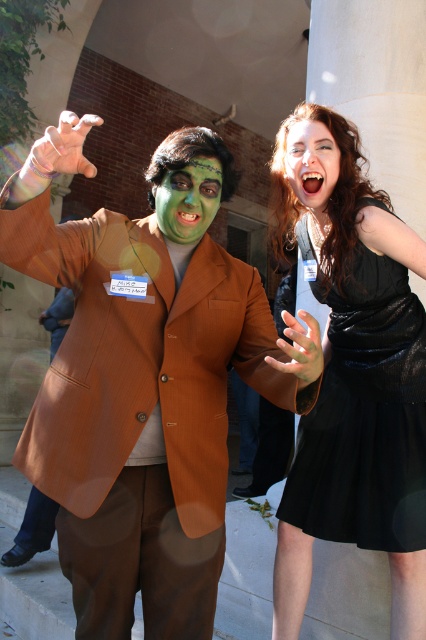
In the scene shown: Does black velvet dress at right have a lesser width compared to green matte face at center?

In fact, black velvet dress at right might be wider than green matte face at center.

Does black velvet dress at right come behind green matte face at center?

Yes, black velvet dress at right is behind green matte face at center.

Consider the image. Who is more forward, (411, 445) or (212, 212)?

Point (212, 212) is in front.

Where is `black velvet dress at right`? Image resolution: width=426 pixels, height=640 pixels. black velvet dress at right is located at coordinates (365, 417).

Does green matte face at center have a lesser height compared to matte black hair at upper right?

Yes.

Can you confirm if green matte face at center is smaller than matte black hair at upper right?

Yes.

Who is more forward, (x=186, y=211) or (x=291, y=140)?

Point (x=186, y=211) is more forward.

You are a GUI agent. You are given a task and a screenshot of the screen. Output one action in this format:
    pyautogui.click(x=<x>, y=<y>)
    Task: Click on the green matte face at center
    The image size is (426, 640).
    Given the screenshot: What is the action you would take?
    pyautogui.click(x=189, y=198)

Is black velvet dress at right below matte black hair at upper right?

Indeed, black velvet dress at right is positioned under matte black hair at upper right.

Between black velvet dress at right and matte black hair at upper right, which one is positioned higher?

Positioned higher is matte black hair at upper right.

Is point (340, 307) less distant than point (331, 150)?

No, it is behind (331, 150).

Find the location of a particular element. black velvet dress at right is located at coordinates (365, 417).